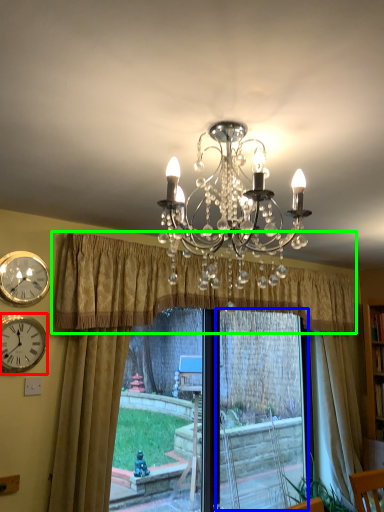
Question: Based on their relative distances, which object is farther from wall clock (highlighted by a red box)? Choose from window frame (highlighted by a blue box) and curtain (highlighted by a green box).

Choices:
 (A) window frame
 (B) curtain

Answer: (A)